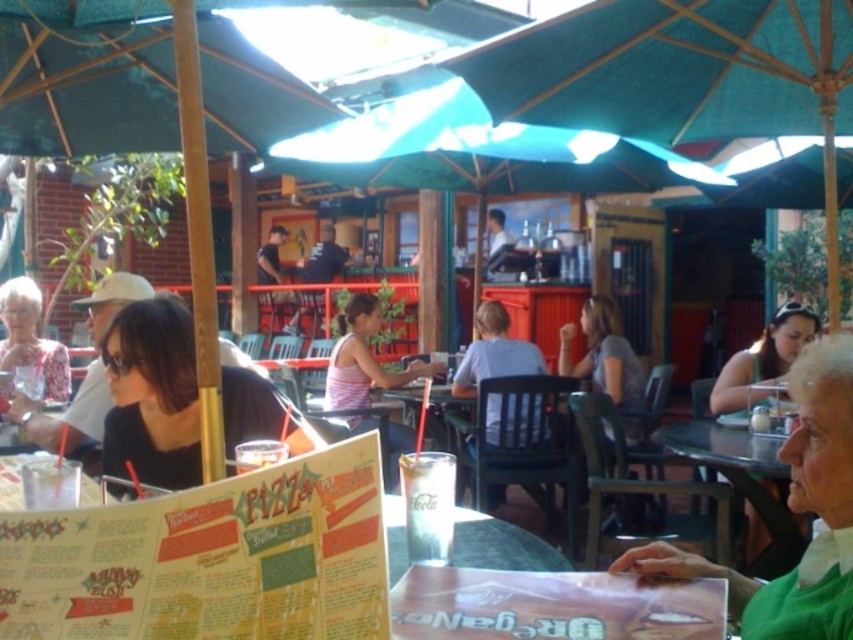
You are a customer at the outdoor dining area and want to choose a shirt to wear for your date tonight. Both the light blue shirt at center and the matte black shirt at center are available. Which shirt has a bigger size?

The light blue shirt at center is larger in size than the matte black shirt at center, so the light blue shirt at center has a bigger size.

You are a customer at the restaurant and want to choose between the light blue shirt at center and the matte black shirt at center. Which one is shorter?

The light blue shirt at center is not as tall as matte black shirt at center, so the light blue shirt at center is shorter.

You are a customer at the outdoor dining area and want to check the menu while keeping your sunglasses on. Since you need to read the menu clearly, will the printed paper menu at center fit under your matte black sunglasses at right without overlapping?

The printed paper menu at center is narrower than the matte black sunglasses at right, so it can fit under the sunglasses without overlapping.